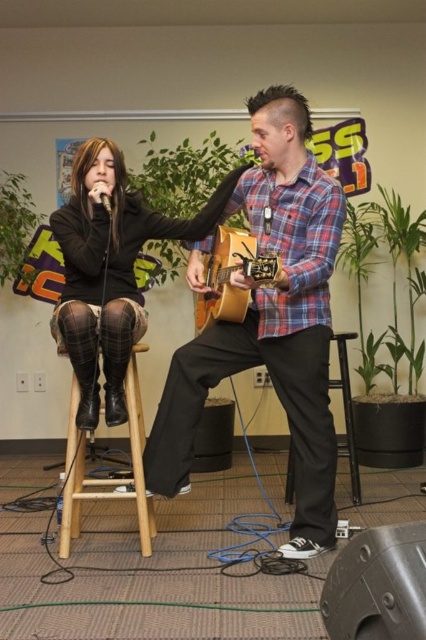
Who is more distant from viewer, (69,461) or (291,483)?

Point (291,483)

Does point (86, 497) come behind point (339, 369)?

That is False.

Between point (71, 525) and point (328, 380), which one is positioned in front?

Positioned in front is point (328, 380).

I want to click on wooden stool at left, so click(x=77, y=480).

Is plaid fabric guitar at center to the left of plaid fabric skirt at center from the viewer's perspective?

Incorrect, plaid fabric guitar at center is not on the left side of plaid fabric skirt at center.

What do you see at coordinates (270, 323) in the screenshot? Image resolution: width=426 pixels, height=640 pixels. I see `plaid fabric guitar at center` at bounding box center [270, 323].

Is point (249, 189) closer to viewer compared to point (71, 253)?

Yes, it is.

Locate an element on the screen. plaid fabric guitar at center is located at coordinates (270, 323).

Looking at this image, does wooden stool at left have a greater width compared to brown plaid fabric chair at center?

In fact, wooden stool at left might be narrower than brown plaid fabric chair at center.

Where is `wooden stool at left`? wooden stool at left is located at coordinates (77, 480).

From the picture: Who is more distant from viewer, (71, 410) or (111, 452)?

Positioned behind is point (111, 452).

In order to click on wooden stool at left in this screenshot , I will do `click(77, 480)`.